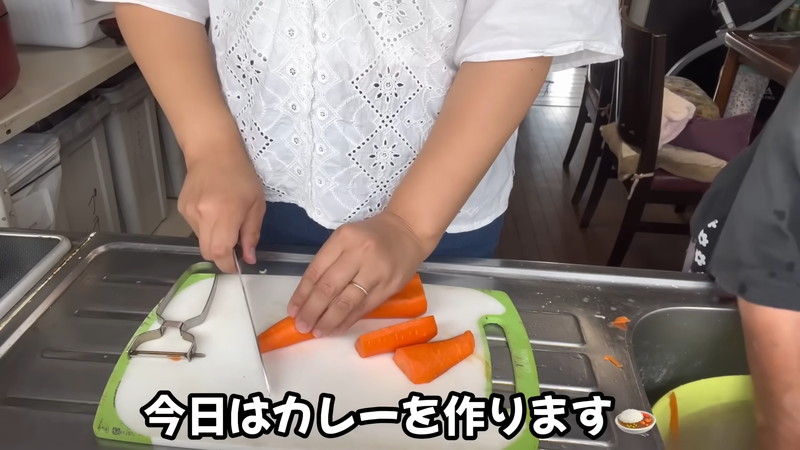
Where is `bowl`? The height and width of the screenshot is (450, 800). bowl is located at coordinates (701, 393).